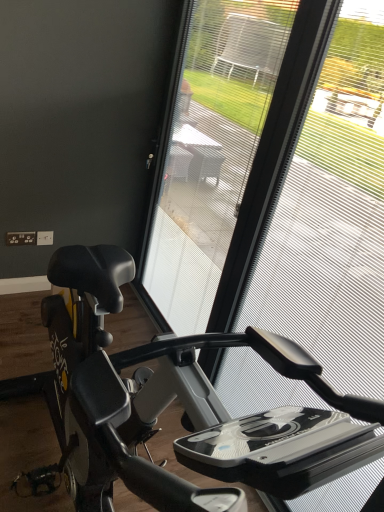
What is the approximate height of transparent mesh at center?

transparent mesh at center is 4.70 feet tall.

Locate an element on the screen. The height and width of the screenshot is (512, 384). transparent mesh at center is located at coordinates (333, 217).

The image size is (384, 512). I want to click on transparent plastic screen door at center, so click(211, 153).

Find the location of `screen door to the left of transparent mesh at center`. screen door to the left of transparent mesh at center is located at coordinates (211, 153).

Is transparent mesh at center wider or thinner than transparent plastic screen door at center?

In the image, transparent mesh at center appears to be more narrow than transparent plastic screen door at center.

Is transparent mesh at center directly adjacent to transparent plastic screen door at center?

No.

Considering the relative sizes of transparent mesh at center and transparent plastic screen door at center in the image provided, is transparent mesh at center taller than transparent plastic screen door at center?

No, transparent mesh at center is not taller than transparent plastic screen door at center.

From a real-world perspective, between black matte stationary bicycle at center and transparent plastic screen door at center, who is vertically lower?

In real-world perspective, black matte stationary bicycle at center is lower.

Is black matte stationary bicycle at center bigger than transparent plastic screen door at center?

Yes, black matte stationary bicycle at center is bigger than transparent plastic screen door at center.

Is black matte stationary bicycle at center placed right next to transparent plastic screen door at center?

No, black matte stationary bicycle at center is not in contact with transparent plastic screen door at center.

Looking at this image, who is bigger, black matte stationary bicycle at center or transparent mesh at center?

black matte stationary bicycle at center is bigger.

Is black matte stationary bicycle at center oriented away from transparent mesh at center?

Yes, black matte stationary bicycle at center is positioned with its back facing transparent mesh at center.

Which object is wider, black matte stationary bicycle at center or transparent mesh at center?

black matte stationary bicycle at center.

Considering the positions of point (102, 429) and point (346, 53), is point (102, 429) closer or farther from the camera than point (346, 53)?

Point (102, 429) appears to be closer to the viewer than point (346, 53).

Between transparent plastic screen door at center and transparent mesh at center, which one has less height?

transparent mesh at center.

Is transparent plastic screen door at center far from transparent mesh at center?

transparent plastic screen door at center is far away from transparent mesh at center.

Is transparent plastic screen door at center inside or outside of transparent mesh at center?

transparent plastic screen door at center is located beyond the bounds of transparent mesh at center.

Measure the distance between transparent plastic screen door at center and transparent mesh at center.

A distance of 1.27 meters exists between transparent plastic screen door at center and transparent mesh at center.

Is transparent mesh at center to the right of black matte stationary bicycle at center from the viewer's perspective?

Yes.

In the scene shown: Considering the sizes of objects transparent mesh at center and black matte stationary bicycle at center in the image provided, who is bigger, transparent mesh at center or black matte stationary bicycle at center?

Bigger between the two is black matte stationary bicycle at center.

Is transparent mesh at center thinner than black matte stationary bicycle at center?

Indeed, transparent mesh at center has a lesser width compared to black matte stationary bicycle at center.

Can you see transparent mesh at center touching black matte stationary bicycle at center?

No, transparent mesh at center is not next to black matte stationary bicycle at center.

From the picture: Is transparent plastic screen door at center to the right of black matte stationary bicycle at center from the viewer's perspective?

Yes, transparent plastic screen door at center is to the right of black matte stationary bicycle at center.

Does point (179, 231) appear closer or farther from the camera than point (69, 457)?

Point (179, 231).

In the scene shown: Considering the relative sizes of transparent plastic screen door at center and black matte stationary bicycle at center in the image provided, is transparent plastic screen door at center bigger than black matte stationary bicycle at center?

Actually, transparent plastic screen door at center might be smaller than black matte stationary bicycle at center.

Based on the photo, which of these two, transparent plastic screen door at center or black matte stationary bicycle at center, is wider?

Wider between the two is black matte stationary bicycle at center.

This screenshot has width=384, height=512. In order to click on screen door behind the transparent mesh at center in this screenshot , I will do `click(211, 153)`.

Where is `stationary bicycle below the transparent plastic screen door at center (from a real-world perspective)`? stationary bicycle below the transparent plastic screen door at center (from a real-world perspective) is located at coordinates [181, 401].

Considering their positions, is black matte stationary bicycle at center positioned further to transparent plastic screen door at center than transparent mesh at center?

transparent mesh at center.

Considering their positions, is black matte stationary bicycle at center positioned closer to transparent mesh at center than transparent plastic screen door at center?

The object closer to transparent mesh at center is transparent plastic screen door at center.

Estimate the real-world distances between objects in this image. Which object is further from transparent plastic screen door at center, transparent mesh at center or black matte stationary bicycle at center?

Based on the image, transparent mesh at center appears to be further to transparent plastic screen door at center.

Estimate the real-world distances between objects in this image. Which object is further from transparent mesh at center, transparent plastic screen door at center or black matte stationary bicycle at center?

Among the two, black matte stationary bicycle at center is located further to transparent mesh at center.

Looking at the image, which one is located further to black matte stationary bicycle at center, transparent mesh at center or transparent plastic screen door at center?

transparent mesh at center.

Considering their positions, is transparent plastic screen door at center positioned closer to black matte stationary bicycle at center than transparent mesh at center?

transparent plastic screen door at center is closer to black matte stationary bicycle at center.

Locate an element on the screen. The height and width of the screenshot is (512, 384). window screen between black matte stationary bicycle at center and transparent plastic screen door at center along the z-axis is located at coordinates (333, 217).